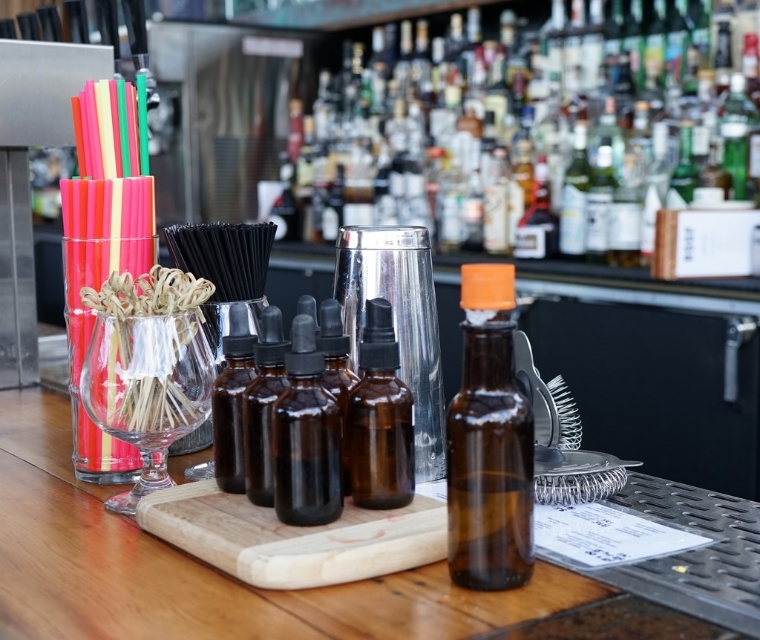
Question: Is shiny silver cocktail shaker at center closer to the viewer compared to brown glass dropper bottle at center?

Choices:
 (A) no
 (B) yes

Answer: (A)

Question: Does shiny silver cocktail shaker at center appear on the left side of brown glass bottles at center?

Choices:
 (A) yes
 (B) no

Answer: (B)

Question: Estimate the real-world distances between objects in this image. Which object is farther from the shiny silver cocktail shaker at center?

Choices:
 (A) amber glass bottle at center
 (B) brown glass dropper bottles at center
 (C) brown glass dropper bottle at center
 (D) brown glass bottles at center

Answer: (C)

Question: Which point is farther from the camera taking this photo?

Choices:
 (A) (298, 561)
 (B) (298, 445)
 (C) (390, 358)
 (D) (252, 387)

Answer: (D)

Question: Is shiny silver cocktail shaker at center behind brown glass dropper bottles at center?

Choices:
 (A) yes
 (B) no

Answer: (A)

Question: Which of these objects is positioned closest to the amber glass dropper bottle at center?

Choices:
 (A) wooden cutting board at center
 (B) brown glass dropper bottle at center
 (C) brown glass dropper bottles at center
 (D) brown glass bottles at center

Answer: (B)